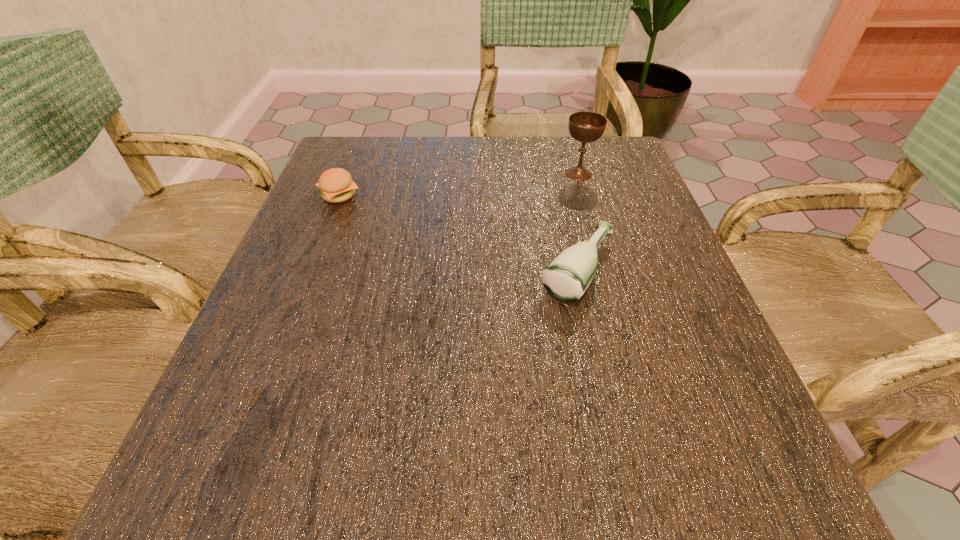
Where is `object that is at the left edge`? object that is at the left edge is located at coordinates (336, 184).

Find the location of `chalice that is positioned at the right edge`. chalice that is positioned at the right edge is located at coordinates (584, 126).

Image resolution: width=960 pixels, height=540 pixels. In order to click on bottle located in the right edge section of the desktop in this screenshot , I will do `click(566, 278)`.

Find the location of a particular element. This screenshot has width=960, height=540. object at the far left corner is located at coordinates (336, 184).

Find the location of a particular element. This screenshot has height=540, width=960. object that is at the far right corner is located at coordinates (584, 126).

I want to click on free space at the far edge, so click(458, 138).

In order to click on vacant space at the near edge of the desktop in this screenshot , I will do `click(507, 484)`.

Identify the location of vacant space at the left edge of the desktop. (276, 352).

Identify the location of blank area at the right edge. This screenshot has height=540, width=960. (633, 262).

This screenshot has width=960, height=540. I want to click on vacant space at the far left corner of the desktop, so click(364, 167).